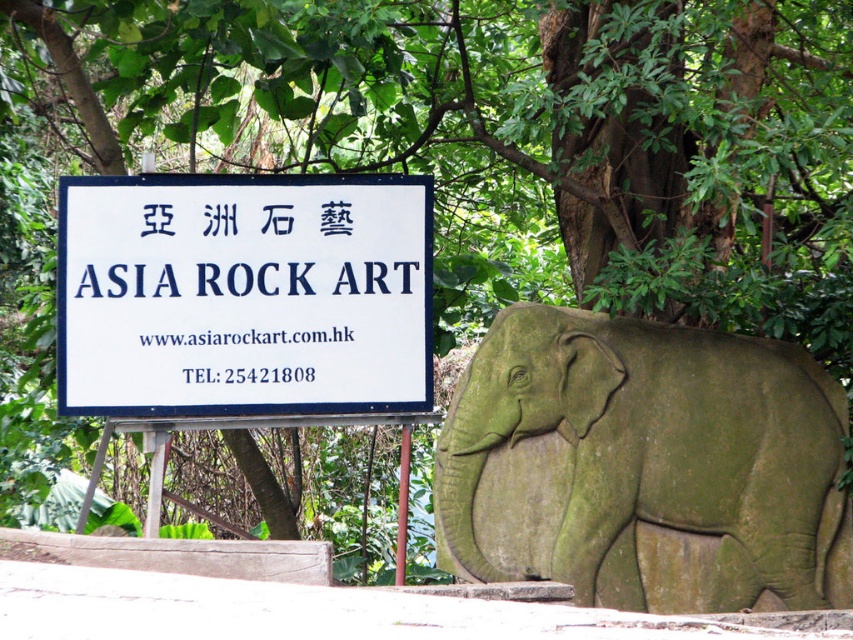
You are standing in front of the Asia Rock Art signboard. Where is the green stone elephant at right located relative to the signboard?

The green stone elephant at right is located to the right of the signboard.

You are standing in front of the Asia Rock Art signboard and notice the green stone elephant at right and the white paper sign at upper center. Which object is nearer to you?

The green stone elephant at right is closer to the viewer than the white paper sign at upper center.